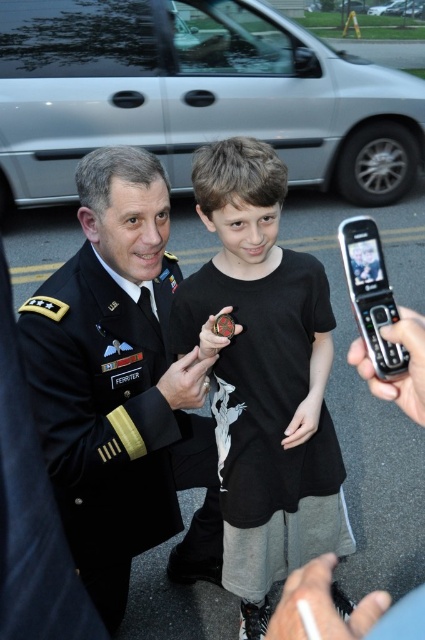
Is black matte shirt at center to the right of black wool military uniform at center from the viewer's perspective?

Correct, you'll find black matte shirt at center to the right of black wool military uniform at center.

Between point (252, 368) and point (93, 564), which one is positioned behind?

Point (93, 564)

This screenshot has width=425, height=640. Find the location of `black matte shirt at center`. black matte shirt at center is located at coordinates (263, 378).